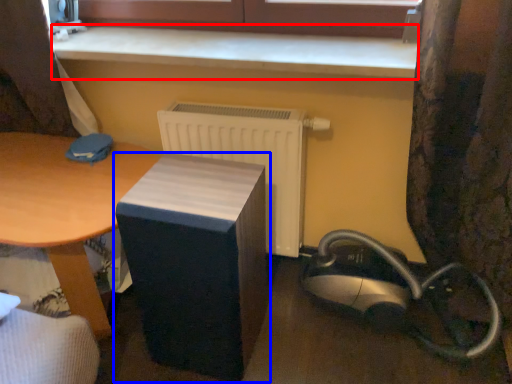
Question: Which of the following is the closest to the observer, counter top (highlighted by a red box) or furniture (highlighted by a blue box)?

Choices:
 (A) counter top
 (B) furniture

Answer: (B)